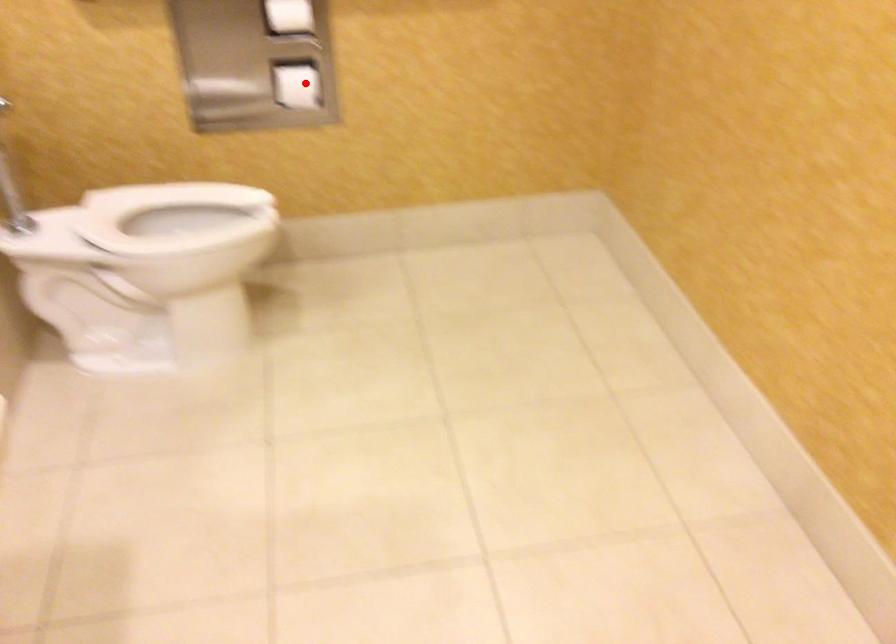
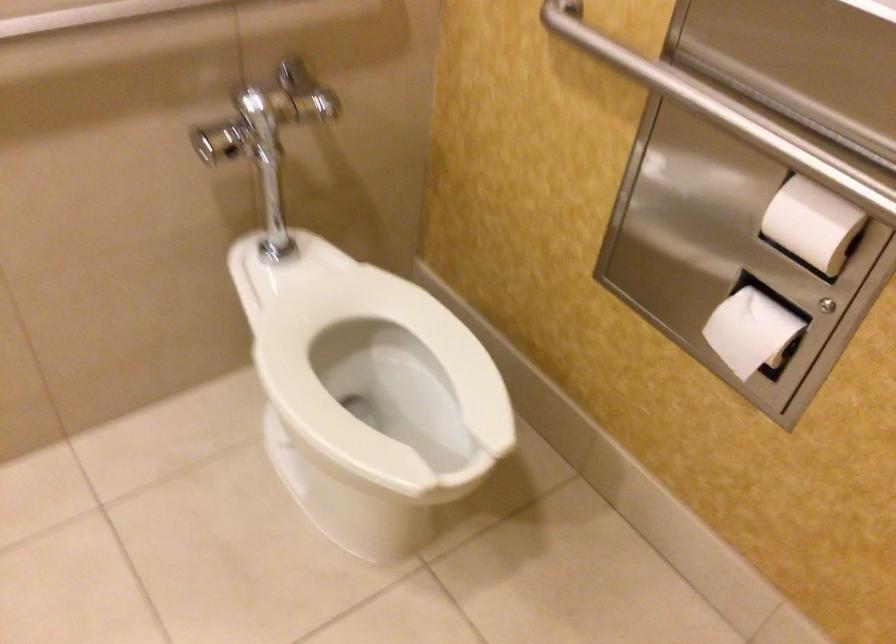
Question: I am providing you with two images of the same scene from different viewpoints. Given a red point in image1, look at the same physical point in image2. Is it:

Choices:
 (A) Closer to the viewpoint
 (B) Farther from the viewpoint

Answer: (A)